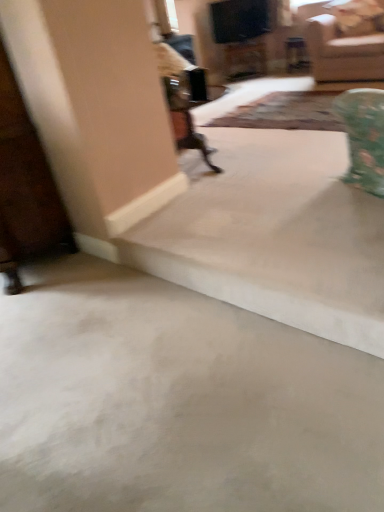
What do you see at coordinates (285, 112) in the screenshot? I see `patterned fabric mat at center` at bounding box center [285, 112].

Locate an element on the screen. The height and width of the screenshot is (512, 384). beige smooth concrete at lower center is located at coordinates (176, 401).

Can you confirm if beige fabric couch at upper right is bigger than beige smooth concrete at lower center?

Yes.

Is beige fabric couch at upper right located outside beige smooth concrete at lower center?

Yes, beige fabric couch at upper right is outside of beige smooth concrete at lower center.

Which object is closer to the camera, beige fabric couch at upper right or beige smooth concrete at lower center?

beige smooth concrete at lower center.

Is beige fabric couch at upper right positioned beyond the bounds of patterned fabric mat at center?

beige fabric couch at upper right is positioned outside patterned fabric mat at center.

Can you confirm if beige fabric couch at upper right is taller than patterned fabric mat at center?

Indeed, beige fabric couch at upper right has a greater height compared to patterned fabric mat at center.

Is beige fabric couch at upper right far from patterned fabric mat at center?

Actually, beige fabric couch at upper right and patterned fabric mat at center are a little close together.

Is patterned fabric mat at center facing away from beige fabric couch at upper right?

No, patterned fabric mat at center's orientation is not away from beige fabric couch at upper right.

Is patterned fabric mat at center taller or shorter than beige fabric couch at upper right?

Considering their sizes, patterned fabric mat at center has less height than beige fabric couch at upper right.

Does point (333, 119) come farther from viewer compared to point (346, 73)?

That is False.

Could you tell me if beige smooth concrete at lower center is turned towards beige fabric couch at upper right?

No, beige smooth concrete at lower center is not oriented towards beige fabric couch at upper right.

Between beige smooth concrete at lower center and beige fabric couch at upper right, which one has smaller size?

Smaller between the two is beige smooth concrete at lower center.

Considering the sizes of objects beige smooth concrete at lower center and beige fabric couch at upper right in the image provided, who is shorter, beige smooth concrete at lower center or beige fabric couch at upper right?

beige smooth concrete at lower center.

What's the angular difference between beige smooth concrete at lower center and beige fabric couch at upper right's facing directions?

There is a 89.8-degree angle between the facing directions of beige smooth concrete at lower center and beige fabric couch at upper right.

Can you tell me how much beige smooth concrete at lower center and patterned fabric mat at center differ in facing direction?

beige smooth concrete at lower center and patterned fabric mat at center are facing 89.8 degrees away from each other.

Is patterned fabric mat at center completely or partially inside beige smooth concrete at lower center?

No.

Is beige smooth concrete at lower center aimed at patterned fabric mat at center?

No, beige smooth concrete at lower center is not aimed at patterned fabric mat at center.

In the scene shown: Is beige smooth concrete at lower center smaller than patterned fabric mat at center?

Indeed, beige smooth concrete at lower center has a smaller size compared to patterned fabric mat at center.

Consider the image. Could you tell me if patterned fabric mat at center is turned towards beige smooth concrete at lower center?

No.

Would you consider patterned fabric mat at center to be distant from beige smooth concrete at lower center?

Yes, patterned fabric mat at center is far from beige smooth concrete at lower center.

How many degrees apart are the facing directions of patterned fabric mat at center and beige smooth concrete at lower center?

89.8 degrees separate the facing orientations of patterned fabric mat at center and beige smooth concrete at lower center.

Considering the positions of point (332, 97) and point (110, 334), is point (332, 97) closer or farther from the camera than point (110, 334)?

Point (332, 97) is positioned farther from the camera compared to point (110, 334).

Identify the location of concrete below the beige fabric couch at upper right (from a real-world perspective). (176, 401).

Locate an element on the screen. This screenshot has width=384, height=512. mat in front of the beige fabric couch at upper right is located at coordinates [x=285, y=112].

Considering their positions, is beige smooth concrete at lower center positioned further to patterned fabric mat at center than beige fabric couch at upper right?

beige smooth concrete at lower center is positioned further to the anchor patterned fabric mat at center.

Which object lies further to the anchor point beige smooth concrete at lower center, beige fabric couch at upper right or patterned fabric mat at center?

beige fabric couch at upper right.

Consider the image. Looking at the image, which one is located closer to beige fabric couch at upper right, beige smooth concrete at lower center or patterned fabric mat at center?

Among the two, patterned fabric mat at center is located nearer to beige fabric couch at upper right.

Estimate the real-world distances between objects in this image. Which object is further from beige smooth concrete at lower center, patterned fabric mat at center or beige fabric couch at upper right?

beige fabric couch at upper right.

From the image, which object appears to be farther from patterned fabric mat at center, beige fabric couch at upper right or beige smooth concrete at lower center?

The object further to patterned fabric mat at center is beige smooth concrete at lower center.

Considering their positions, is patterned fabric mat at center positioned further to beige fabric couch at upper right than beige smooth concrete at lower center?

The object further to beige fabric couch at upper right is beige smooth concrete at lower center.

Find the location of a particular element. This screenshot has width=384, height=512. mat between beige smooth concrete at lower center and beige fabric couch at upper right in the front-back direction is located at coordinates (285, 112).